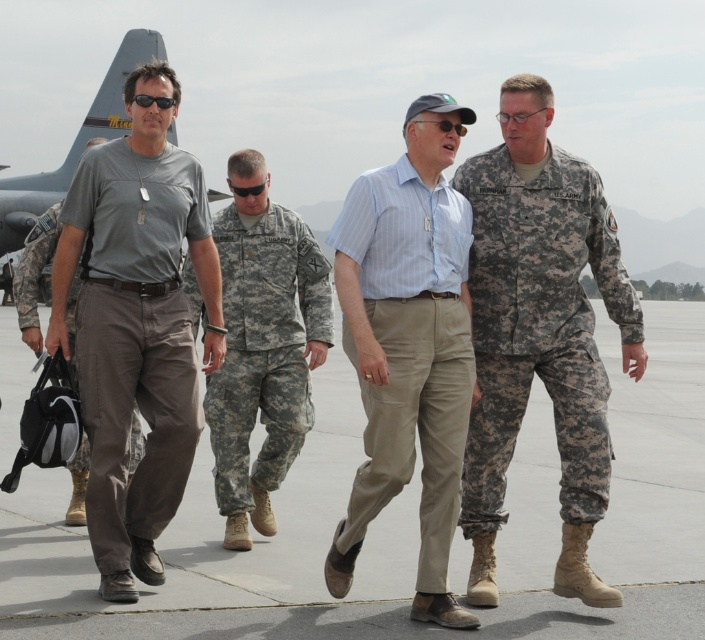
Which of these two, light blue striped shirt at center or matte gray airplane at upper left, stands shorter?

With less height is light blue striped shirt at center.

Find the location of a particular element. light blue striped shirt at center is located at coordinates (407, 344).

Image resolution: width=705 pixels, height=640 pixels. I want to click on light blue striped shirt at center, so click(407, 344).

Who is lower down, matte gray airplane at upper left or gray/cotton pants at left?

gray/cotton pants at left

Does point (23, 212) come behind point (135, 433)?

Yes, it is.

This screenshot has width=705, height=640. What do you see at coordinates (68, 152) in the screenshot? I see `matte gray airplane at upper left` at bounding box center [68, 152].

This screenshot has width=705, height=640. What are the coordinates of `matte gray airplane at upper left` in the screenshot? It's located at (68, 152).

Who is shorter, camouflage fabric uniform at center or matte gray airplane at upper left?

With less height is camouflage fabric uniform at center.

Looking at this image, between camouflage fabric uniform at center and matte gray airplane at upper left, which one appears on the left side from the viewer's perspective?

Positioned to the left is matte gray airplane at upper left.

Identify the location of camouflage fabric uniform at center. The width and height of the screenshot is (705, 640). (264, 348).